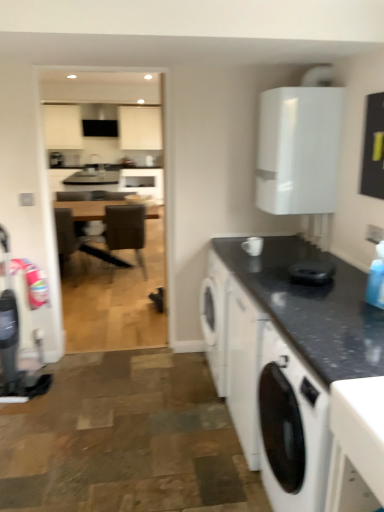
In order to face brown leather chair at center, should I rotate leftwards or rightwards?

To align with it, rotate left about 9.207°.

This screenshot has height=512, width=384. I want to click on white ceramic mug at upper center, arranged as the 2th appliance when viewed from the right, so click(253, 246).

This screenshot has width=384, height=512. Find the location of `white glossy cabinet at upper right`. white glossy cabinet at upper right is located at coordinates (298, 149).

The height and width of the screenshot is (512, 384). Describe the element at coordinates (292, 429) in the screenshot. I see `white matte washing machine at lower right` at that location.

Locate an element on the screen. This screenshot has height=512, width=384. brown wooden table at center is located at coordinates (88, 208).

In terms of size, does brown leather chair at center appear bigger or smaller than white glossy cabinet at upper right?

Clearly, brown leather chair at center is larger in size than white glossy cabinet at upper right.

How far apart are brown leather chair at center and white glossy cabinet at upper right?

The distance of brown leather chair at center from white glossy cabinet at upper right is 8.41 feet.

Which object is positioned more to the left, brown leather chair at center or white glossy cabinet at upper right?

Positioned to the left is brown leather chair at center.

Which object is closer to the camera, brown leather chair at center or white glossy cabinet at upper right?

white glossy cabinet at upper right is more forward.

From the image's perspective, is brown wooden table at center located above white ceramic mug at upper center, acting as the 1th appliance starting from the back?

Yes.

From a real-world perspective, is brown wooden table at center located beneath white ceramic mug at upper center, arranged as the 1th appliance when viewed from the top?

Yes.

Looking at this image, how many degrees apart are the facing directions of brown wooden table at center and white ceramic mug at upper center, the second appliance viewed from the front?

The angle between the facing direction of brown wooden table at center and the facing direction of white ceramic mug at upper center, the second appliance viewed from the front, is 90 degrees.

Are brown wooden table at center and white ceramic mug at upper center, the 1th appliance viewed from the left, located far from each other?

brown wooden table at center is far away from white ceramic mug at upper center, the 1th appliance viewed from the left.

Is brown leather chair at center positioned with its back to black granite countertop at lower right?

Correct, brown leather chair at center is looking away from black granite countertop at lower right.

Considering the sizes of brown leather chair at center and black granite countertop at lower right in the image, is brown leather chair at center wider or thinner than black granite countertop at lower right?

Clearly, brown leather chair at center has less width compared to black granite countertop at lower right.

Considering the relative positions of brown leather chair at center and black granite countertop at lower right in the image provided, is brown leather chair at center to the right of black granite countertop at lower right from the viewer's perspective?

No, brown leather chair at center is not to the right of black granite countertop at lower right.

From the image's perspective, which object appears higher, brown leather chair at center or black granite countertop at lower right?

brown leather chair at center, from the image's perspective.

Could you tell me if black glossy coffee cup at center, which is the 1th appliance from front to back, is turned towards brown leather chair at center?

No, black glossy coffee cup at center, which is the 1th appliance from front to back, is not turned towards brown leather chair at center.

Is black glossy coffee cup at center, which is the 1th appliance from front to back, far from brown leather chair at center?

black glossy coffee cup at center, which is the 1th appliance from front to back, is positioned a significant distance from brown leather chair at center.

Could brown leather chair at center be considered to be inside black glossy coffee cup at center, positioned as the first appliance in right-to-left order?

No, brown leather chair at center is not inside black glossy coffee cup at center, positioned as the first appliance in right-to-left order.

Which is closer to the camera, (323, 265) or (139, 216)?

Positioned in front is point (323, 265).

Do you think white ceramic mug at upper center, acting as the 1th appliance starting from the back, is within black granite countertop at lower right, or outside of it?

white ceramic mug at upper center, acting as the 1th appliance starting from the back, exists outside the volume of black granite countertop at lower right.

Between white ceramic mug at upper center, the second appliance viewed from the front, and black granite countertop at lower right, which one has larger size?

black granite countertop at lower right is bigger.

Which is behind, white ceramic mug at upper center, the second appliance viewed from the front, or black granite countertop at lower right?

white ceramic mug at upper center, the second appliance viewed from the front, is more distant.

Is white ceramic mug at upper center, acting as the 1th appliance starting from the back, aimed at black granite countertop at lower right?

No, white ceramic mug at upper center, acting as the 1th appliance starting from the back, is not turned towards black granite countertop at lower right.

Can you confirm if white ceramic mug at upper center, acting as the 1th appliance starting from the back, is smaller than brown wooden table at center?

Correct, white ceramic mug at upper center, acting as the 1th appliance starting from the back, occupies less space than brown wooden table at center.

How far apart are white ceramic mug at upper center, acting as the second appliance starting from the bottom, and brown wooden table at center?

white ceramic mug at upper center, acting as the second appliance starting from the bottom, is 2.38 meters away from brown wooden table at center.

In the scene shown: Does white ceramic mug at upper center, the second appliance viewed from the front, have a lesser width compared to brown wooden table at center?

Yes.

Is white ceramic mug at upper center, arranged as the 1th appliance when viewed from the top, outside of brown wooden table at center?

white ceramic mug at upper center, arranged as the 1th appliance when viewed from the top, is positioned outside brown wooden table at center.

From a real-world perspective, is white glossy cabinet at upper right above or below brown wooden table at center?

Clearly, from a real-world perspective, white glossy cabinet at upper right is above brown wooden table at center.

Does point (313, 133) come behind point (74, 205)?

No, (313, 133) is closer to viewer.

Which of these two, white glossy cabinet at upper right or brown wooden table at center, is bigger?

With larger size is brown wooden table at center.

Considering the sizes of objects white glossy cabinet at upper right and brown wooden table at center in the image provided, who is taller, white glossy cabinet at upper right or brown wooden table at center?

With more height is brown wooden table at center.

Where is `cabinetry in front of the brown leather chair at center`? The height and width of the screenshot is (512, 384). cabinetry in front of the brown leather chair at center is located at coordinates (298, 149).

The image size is (384, 512). I want to click on table on the left side of white ceramic mug at upper center, acting as the 1th appliance starting from the back, so click(88, 208).

When comparing their distances from white matte washing machine at lower right, does black granite countertop at lower right or white ceramic mug at upper center, the second appliance viewed from the front, seem closer?

black granite countertop at lower right.

From the picture: Considering their positions, is black granite countertop at lower right positioned closer to brown leather chair at center than black glossy coffee cup at center, acting as the second appliance starting from the top?

black granite countertop at lower right.

In the scene shown: When comparing their distances from brown wooden table at center, does black granite countertop at lower right or black glossy coffee cup at center, which is the second appliance in back-to-front order, seem further?

black glossy coffee cup at center, which is the second appliance in back-to-front order.

When comparing their distances from brown leather chair at center, does white glossy cabinet at upper right or black glossy coffee cup at center, which is the 1th appliance from front to back, seem closer?

Result: white glossy cabinet at upper right.

From the image, which object appears to be farther from black glossy coffee cup at center, acting as the second appliance starting from the top, black granite countertop at lower right or brown leather chair at center?

The object further to black glossy coffee cup at center, acting as the second appliance starting from the top, is brown leather chair at center.

Estimate the real-world distances between objects in this image. Which object is closer to white glossy cabinet at upper right, white matte washing machine at lower right or brown wooden table at center?

white matte washing machine at lower right is closer to white glossy cabinet at upper right.

From the image, which object appears to be farther from white matte washing machine at lower right, brown leather chair at center or black granite countertop at lower right?

brown leather chair at center is further to white matte washing machine at lower right.

Which object lies nearer to the anchor point brown wooden table at center, black glossy coffee cup at center, which is the second appliance in back-to-front order, or white matte washing machine at lower right?

black glossy coffee cup at center, which is the second appliance in back-to-front order, is positioned closer to the anchor brown wooden table at center.

Identify the location of cabinetry between white matte washing machine at lower right and brown leather chair at center along the z-axis. This screenshot has height=512, width=384. (298, 149).

Where is `appliance positioned between black granite countertop at lower right and white ceramic mug at upper center, acting as the 1th appliance starting from the back, from near to far`? Image resolution: width=384 pixels, height=512 pixels. appliance positioned between black granite countertop at lower right and white ceramic mug at upper center, acting as the 1th appliance starting from the back, from near to far is located at coordinates (312, 272).

Where is `appliance positioned between black granite countertop at lower right and white glossy cabinet at upper right from near to far`? Image resolution: width=384 pixels, height=512 pixels. appliance positioned between black granite countertop at lower right and white glossy cabinet at upper right from near to far is located at coordinates (312, 272).

This screenshot has height=512, width=384. I want to click on cabinetry located between black granite countertop at lower right and white ceramic mug at upper center, acting as the second appliance starting from the bottom, in the depth direction, so [x=298, y=149].